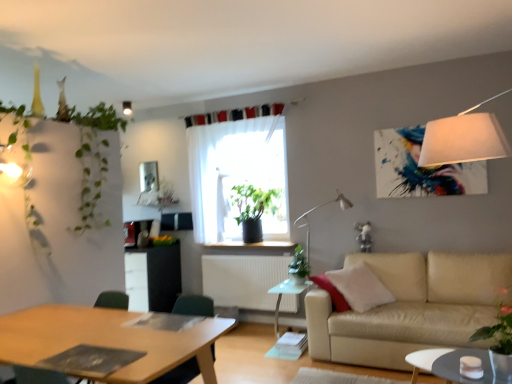
Find the location of a particular element. vacant area on top of wooden desk at lower left (from a real-world perspective) is located at coordinates (92, 332).